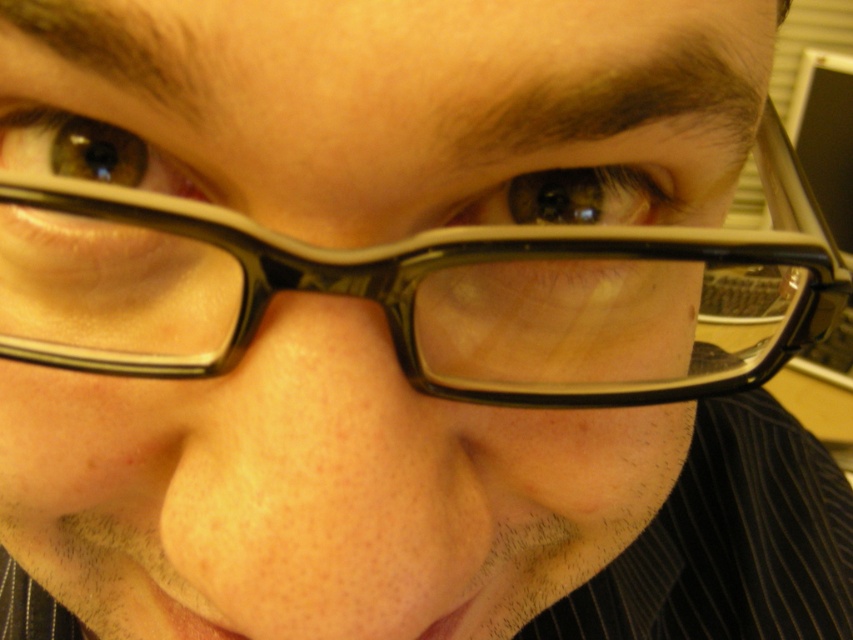
Question: Can you confirm if matte black eye at center is smaller than matte black eye at upper left?

Choices:
 (A) yes
 (B) no

Answer: (B)

Question: Is black plastic glasses at center to the left of matte black eye at upper left from the viewer's perspective?

Choices:
 (A) no
 (B) yes

Answer: (A)

Question: Which of these objects is positioned closest to the matte black eye at center?

Choices:
 (A) matte black eye at upper left
 (B) black plastic glasses at center

Answer: (B)

Question: Can you confirm if matte black eye at center is positioned to the left of matte black eye at upper left?

Choices:
 (A) no
 (B) yes

Answer: (A)

Question: Estimate the real-world distances between objects in this image. Which object is closer to the black plastic glasses at center?

Choices:
 (A) matte black eye at upper left
 (B) matte black eye at center

Answer: (B)

Question: Which object is farther from the camera taking this photo?

Choices:
 (A) matte black eye at center
 (B) black plastic glasses at center

Answer: (A)